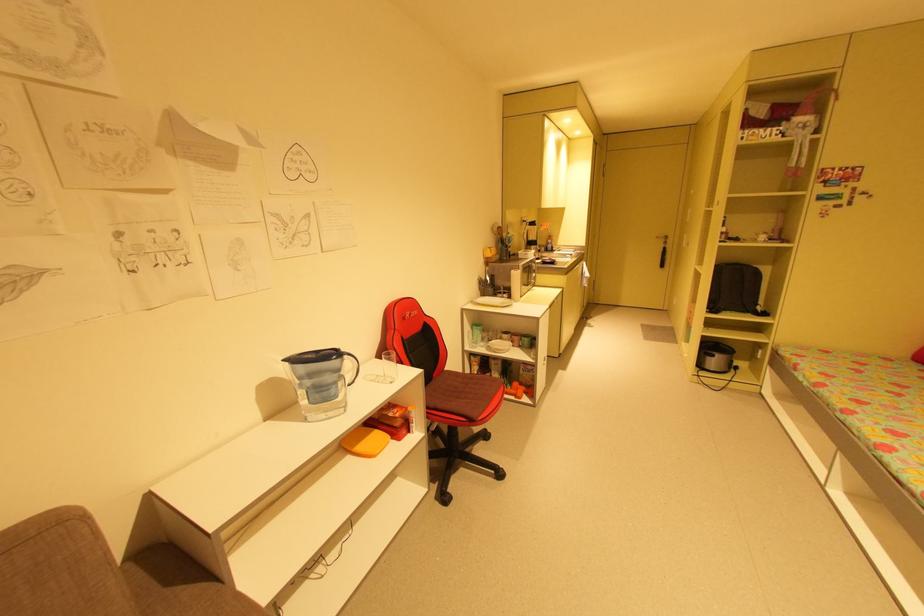
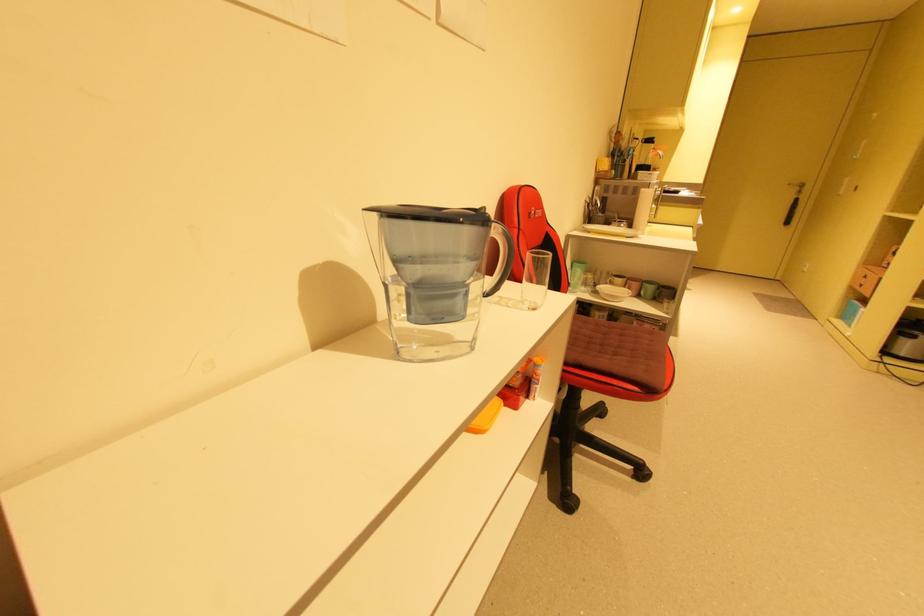
Question: How did the camera likely rotate?

Choices:
 (A) Left
 (B) Right
 (C) Up
 (D) Down

Answer: (D)